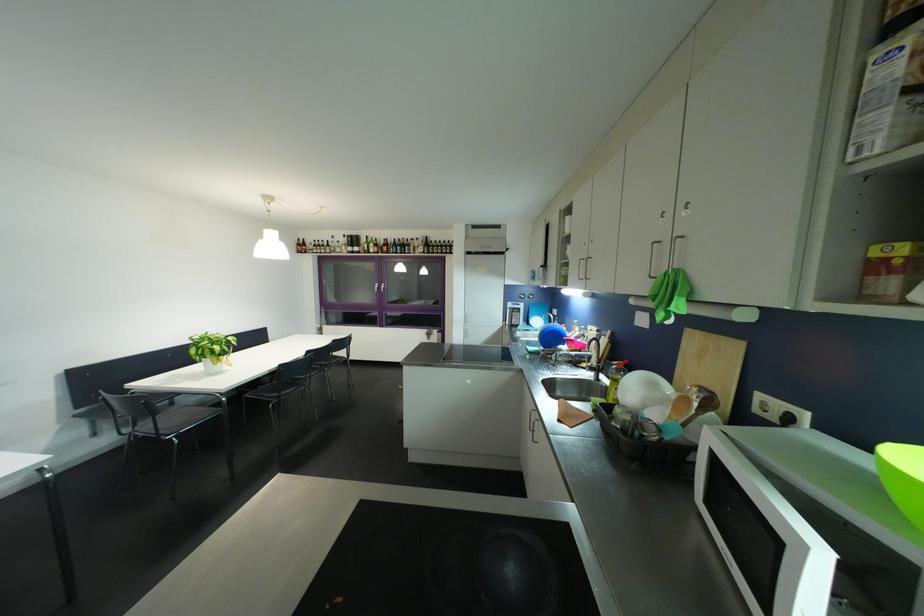
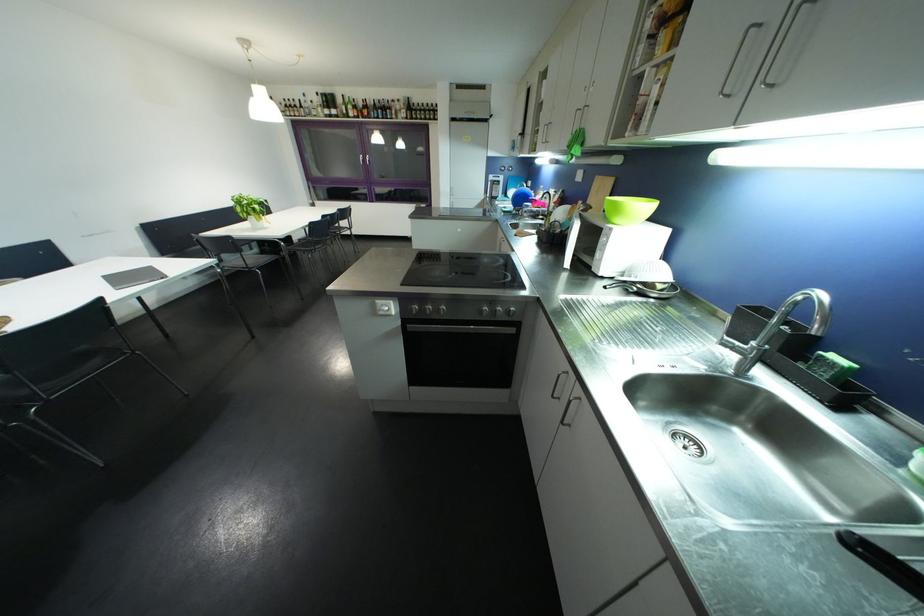
Locate, in the second image, the point that corresponds to [444,249] in the first image.

(428, 113)